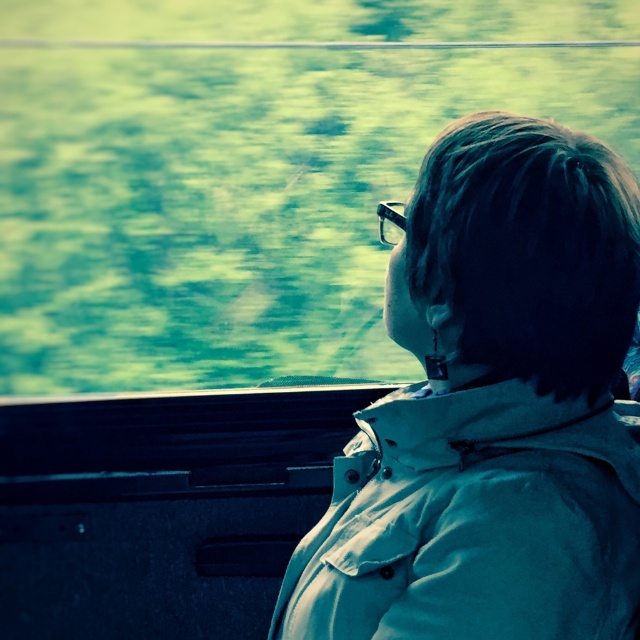
Question: Is transparent glass train window at center wider than white matte jacket at center?

Choices:
 (A) no
 (B) yes

Answer: (B)

Question: Does transparent glass train window at center have a smaller size compared to white matte trench coat at center?

Choices:
 (A) yes
 (B) no

Answer: (B)

Question: Which of these objects is positioned farthest from the white matte trench coat at center?

Choices:
 (A) clear plastic goggles at center
 (B) transparent glass train window at center

Answer: (B)

Question: Which point is farther to the camera?

Choices:
 (A) (378, 204)
 (B) (566, 580)
 (C) (280, 317)
 (D) (440, 624)

Answer: (C)

Question: Among these points, which one is farthest from the camera?

Choices:
 (A) (378, 232)
 (B) (410, 496)
 (C) (29, 93)

Answer: (C)

Question: Observing the image, what is the correct spatial positioning of transparent glass train window at center in reference to clear plastic goggles at center?

Choices:
 (A) right
 (B) left

Answer: (B)